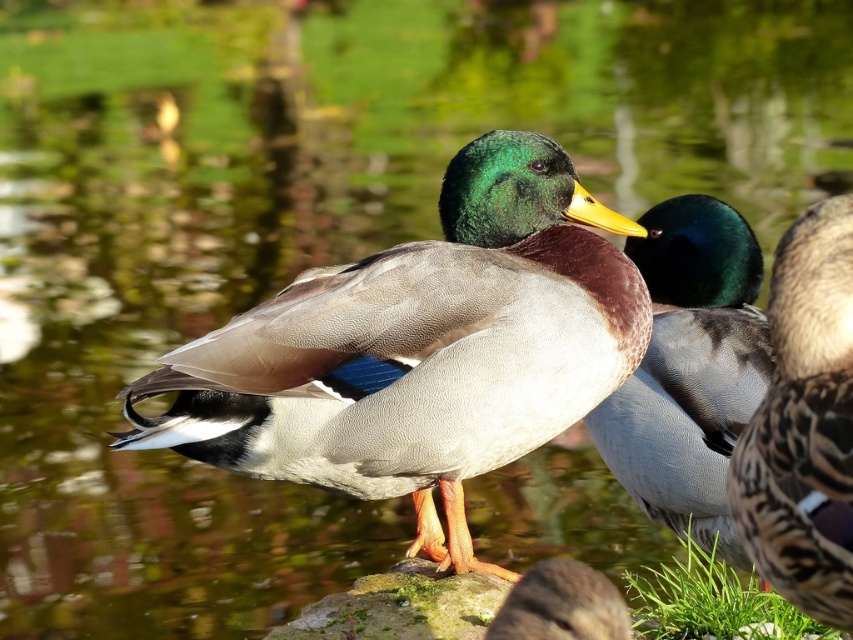
Question: Which of the following is the farthest from the observer?

Choices:
 (A) (576, 637)
 (B) (733, 465)
 (C) (693, 410)
 (D) (700, 608)

Answer: (C)

Question: From the image, what is the correct spatial relationship of green glossy duck at center in relation to brown speckled feathers at center?

Choices:
 (A) above
 (B) below

Answer: (B)

Question: Where is brown speckled feathers at center located in relation to brown speckled feathers at lower center in the image?

Choices:
 (A) right
 (B) left

Answer: (A)

Question: Which is nearer to the shiny brown duck at center?

Choices:
 (A) brown speckled feathers at lower center
 (B) brown speckled feathers at center
 (C) green leafy grass at lower right

Answer: (C)

Question: Which point is closer to the camera?

Choices:
 (A) (704, 385)
 (B) (779, 314)

Answer: (B)

Question: Is green glossy duck at center bigger than brown speckled feathers at lower center?

Choices:
 (A) no
 (B) yes

Answer: (B)